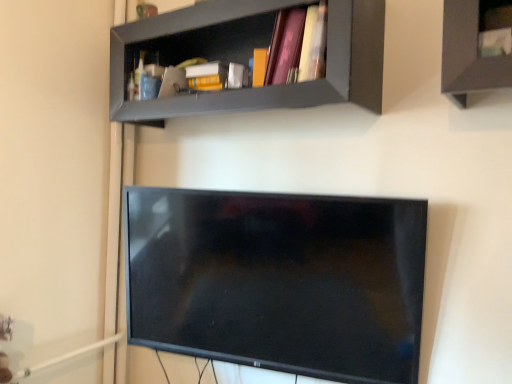
Question: Considering the relative sizes of pink matte book at upper center and matte gray shelf at upper center in the image provided, is pink matte book at upper center shorter than matte gray shelf at upper center?

Choices:
 (A) no
 (B) yes

Answer: (B)

Question: Can we say pink matte book at upper center lies outside matte gray shelf at upper center?

Choices:
 (A) no
 (B) yes

Answer: (A)

Question: From the image's perspective, is pink matte book at upper center located beneath matte gray shelf at upper center?

Choices:
 (A) yes
 (B) no

Answer: (A)

Question: From a real-world perspective, is pink matte book at upper center physically above matte gray shelf at upper center?

Choices:
 (A) no
 (B) yes

Answer: (B)

Question: Is pink matte book at upper center far from matte gray shelf at upper center?

Choices:
 (A) no
 (B) yes

Answer: (A)

Question: Does pink matte book at upper center have a lesser width compared to matte gray shelf at upper center?

Choices:
 (A) no
 (B) yes

Answer: (B)

Question: Does matte gray shelf at upper center have a greater width compared to pink matte book at upper center?

Choices:
 (A) yes
 (B) no

Answer: (A)

Question: Is matte gray shelf at upper center positioned far away from pink matte book at upper center?

Choices:
 (A) no
 (B) yes

Answer: (A)

Question: Is matte gray shelf at upper center in front of pink matte book at upper center?

Choices:
 (A) yes
 (B) no

Answer: (A)

Question: Is matte gray shelf at upper center taller than pink matte book at upper center?

Choices:
 (A) no
 (B) yes

Answer: (B)

Question: Does matte gray shelf at upper center appear on the left side of pink matte book at upper center?

Choices:
 (A) no
 (B) yes

Answer: (B)

Question: Can we say matte gray shelf at upper center lies outside pink matte book at upper center?

Choices:
 (A) no
 (B) yes

Answer: (B)

Question: Considering their positions, is pink matte book at upper center located in front of or behind matte gray shelf at upper center?

Choices:
 (A) front
 (B) behind

Answer: (B)